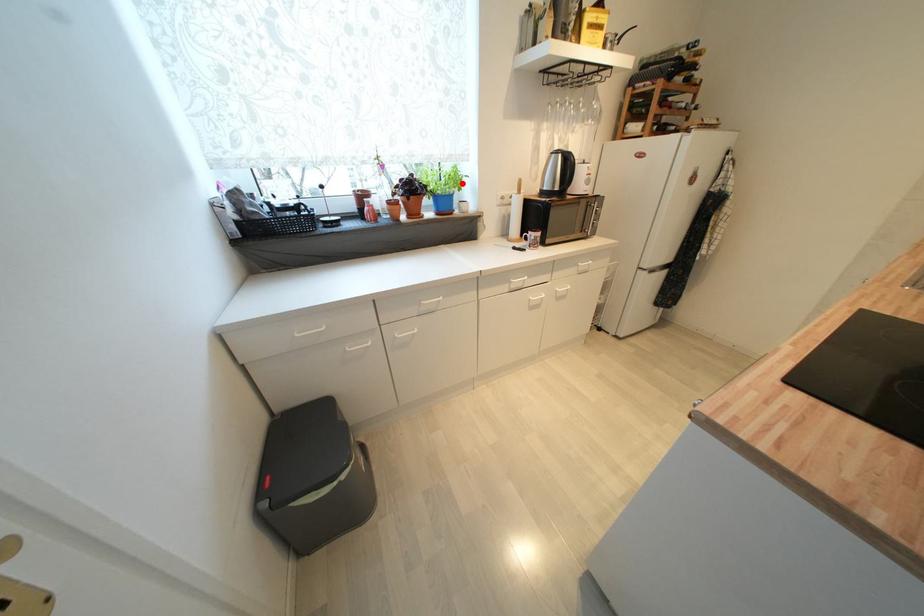
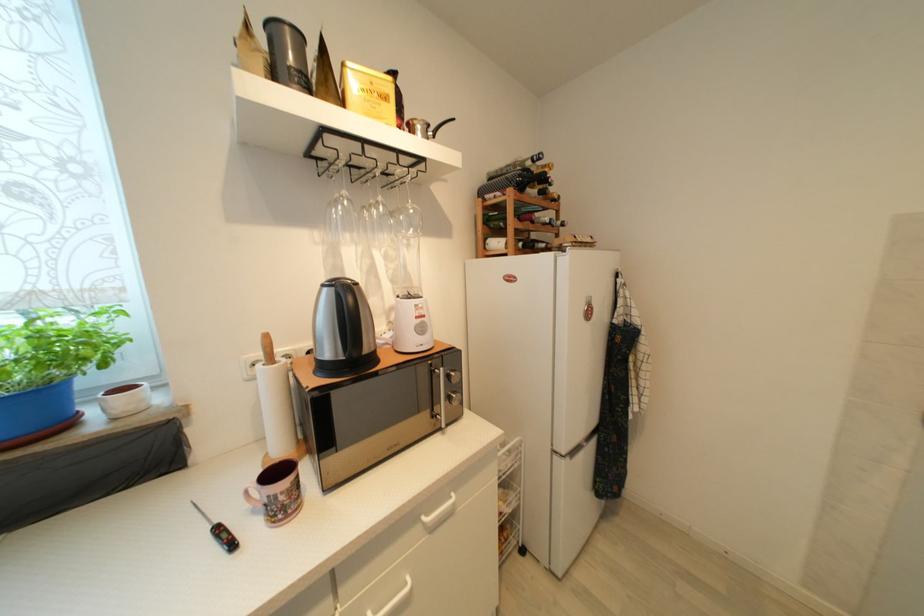
Question: I am providing you with two images of the same scene from different viewpoints. In image1, a red point is highlighted. Considering the same 3D point in image2, which of the following is correct?

Choices:
 (A) It is closer
 (B) It is farther

Answer: (B)